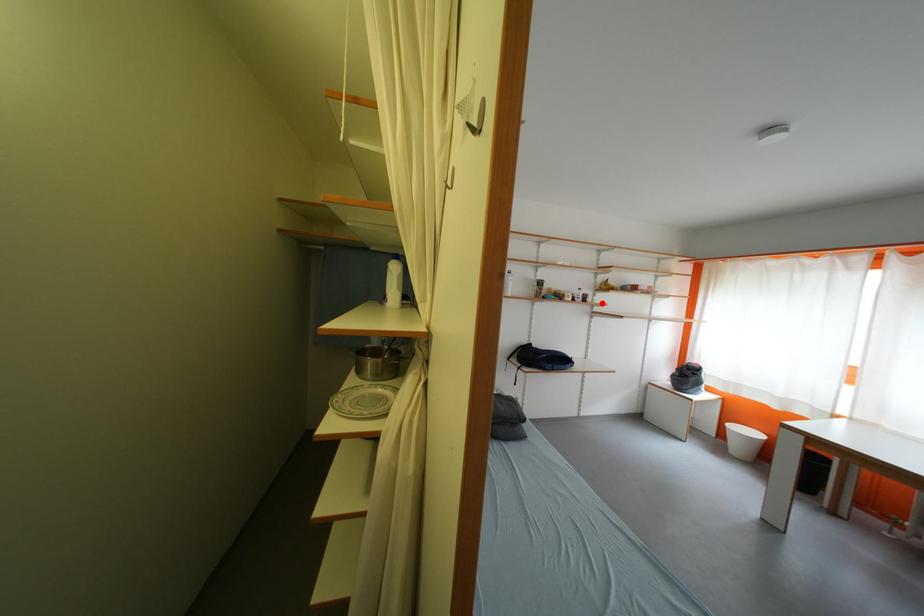
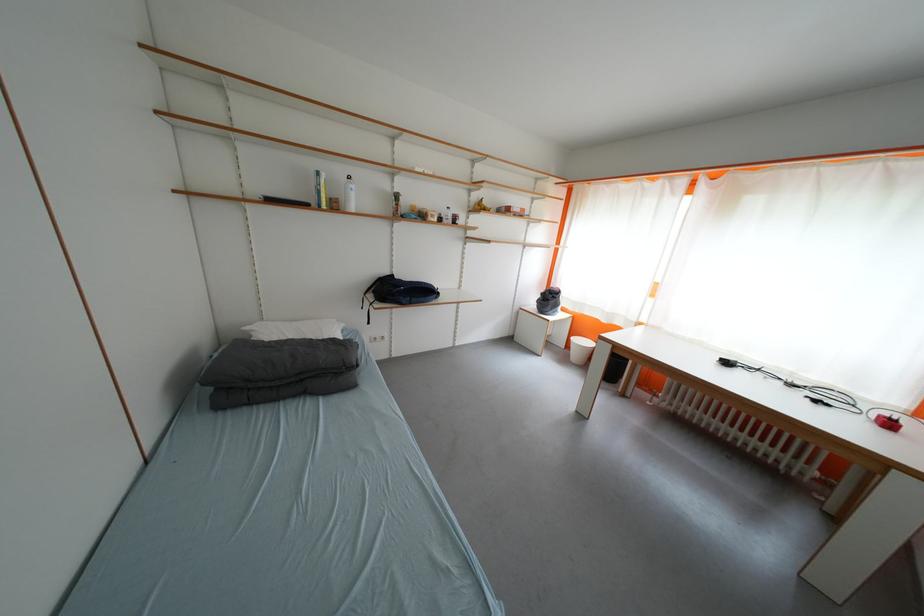
Question: I am providing you with two images of the same scene from different viewpoints. Image1 has a red point marked. In image2, the corresponding 3D location appears at what relative position? Reply with the corresponding letter.

Choices:
 (A) Closer
 (B) Farther

Answer: (A)